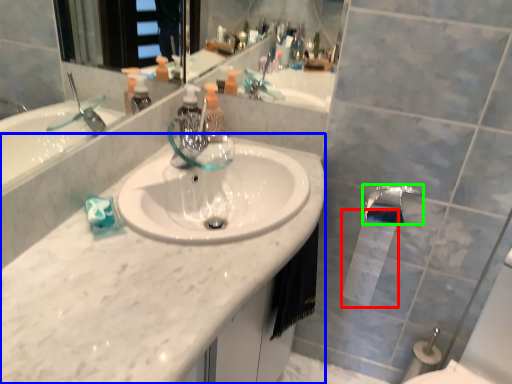
Question: Estimate the real-world distances between objects in this image. Which object is farther from toilet paper (highlighted by a red box), counter top (highlighted by a blue box) or tap (highlighted by a green box)?

Choices:
 (A) counter top
 (B) tap

Answer: (A)